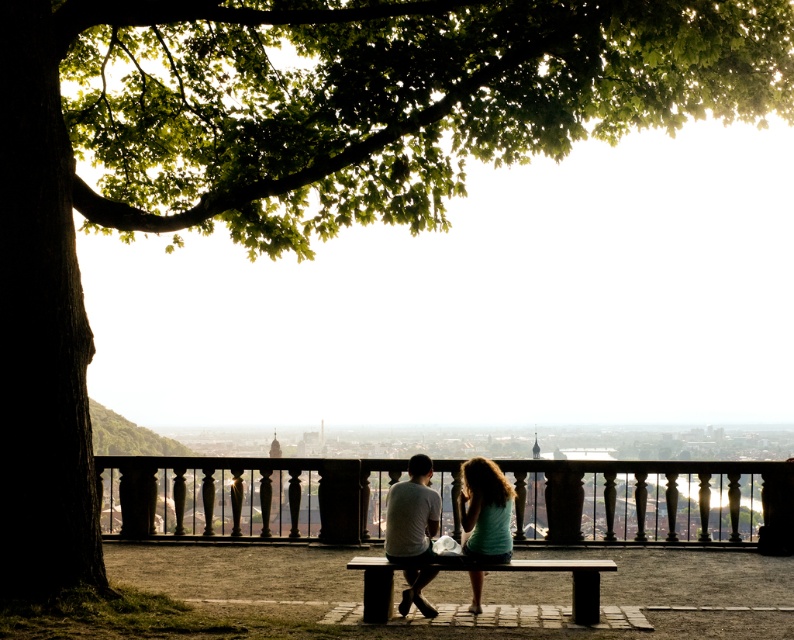
Question: Which object appears closest to the camera in this image?

Choices:
 (A) matte white shirt at center
 (B) light blue fabric skirt at center
 (C) gray cotton t-shirt at center

Answer: (C)

Question: Does wooden bench at center appear on the right side of gray cotton t-shirt at center?

Choices:
 (A) no
 (B) yes

Answer: (B)

Question: In this image, where is wooden bench at center located relative to light blue fabric skirt at center?

Choices:
 (A) right
 (B) left

Answer: (B)

Question: Based on their relative distances, which object is nearer to the wooden bench at center?

Choices:
 (A) gray cotton t-shirt at center
 (B) matte white shirt at center
 (C) light blue fabric skirt at center

Answer: (B)

Question: From the image, what is the correct spatial relationship of wooden bench at center in relation to light blue fabric skirt at center?

Choices:
 (A) left
 (B) right

Answer: (A)

Question: Which of the following is the farthest from the observer?

Choices:
 (A) (471, 524)
 (B) (448, 564)
 (C) (469, 461)
 (D) (436, 508)

Answer: (C)